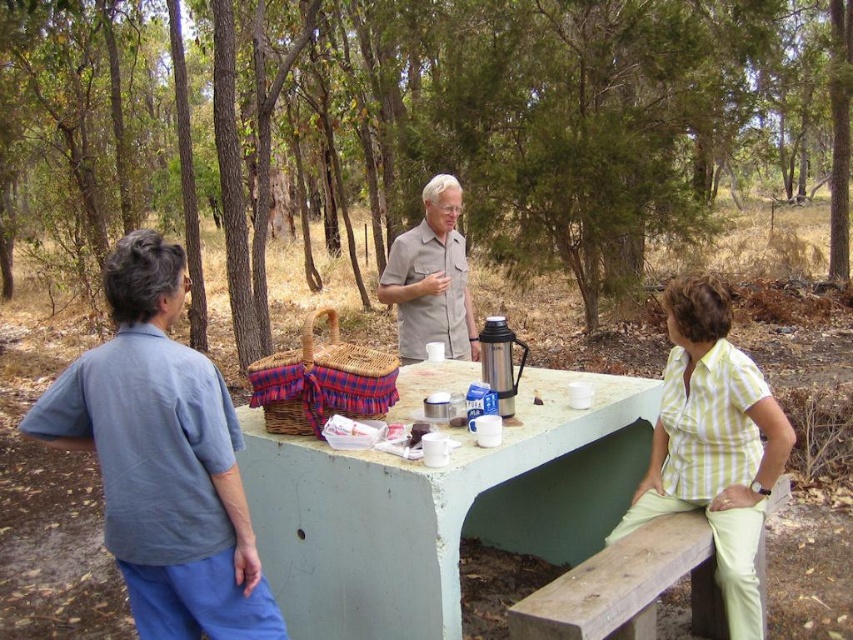
Is green leafy tree at center taller than blue cotton shirt at upper left?

Yes.

Does green leafy tree at center have a lesser width compared to blue cotton shirt at upper left?

No, green leafy tree at center is not thinner than blue cotton shirt at upper left.

You are a GUI agent. You are given a task and a screenshot of the screen. Output one action in this format:
    pyautogui.click(x=<x>, y=<y>)
    Task: Click on the green leafy tree at center
    
    Given the screenshot: What is the action you would take?
    pyautogui.click(x=534, y=120)

Can you confirm if light green concrete table at center is positioned to the right of plaid fabric picnic basket at center?

Indeed, light green concrete table at center is positioned on the right side of plaid fabric picnic basket at center.

Does light green concrete table at center have a lesser width compared to plaid fabric picnic basket at center?

No.

Which is behind, point (434, 608) or point (262, 387)?

Point (262, 387)

Locate an element on the screen. The height and width of the screenshot is (640, 853). light green concrete table at center is located at coordinates (439, 508).

Who is more distant from viewer, (418,58) or (314,317)?

Point (314,317)

Describe the element at coordinates (534, 120) in the screenshot. I see `green leafy tree at center` at that location.

At what (x,y) coordinates should I click in order to perform the action: click on green leafy tree at center. Please return your answer as a coordinate pair (x, y). Image resolution: width=853 pixels, height=640 pixels. Looking at the image, I should click on (534, 120).